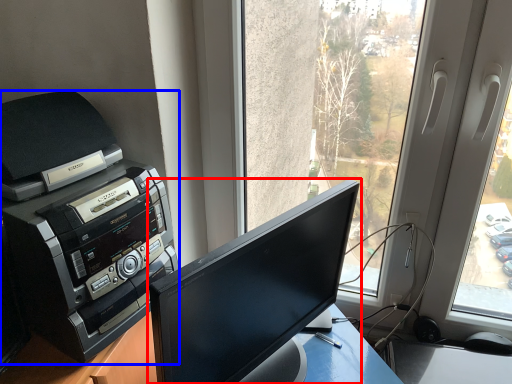
Question: Which point is closer to the camera, computer monitor (highlighted by a red box) or printer (highlighted by a blue box)?

Choices:
 (A) computer monitor
 (B) printer

Answer: (A)